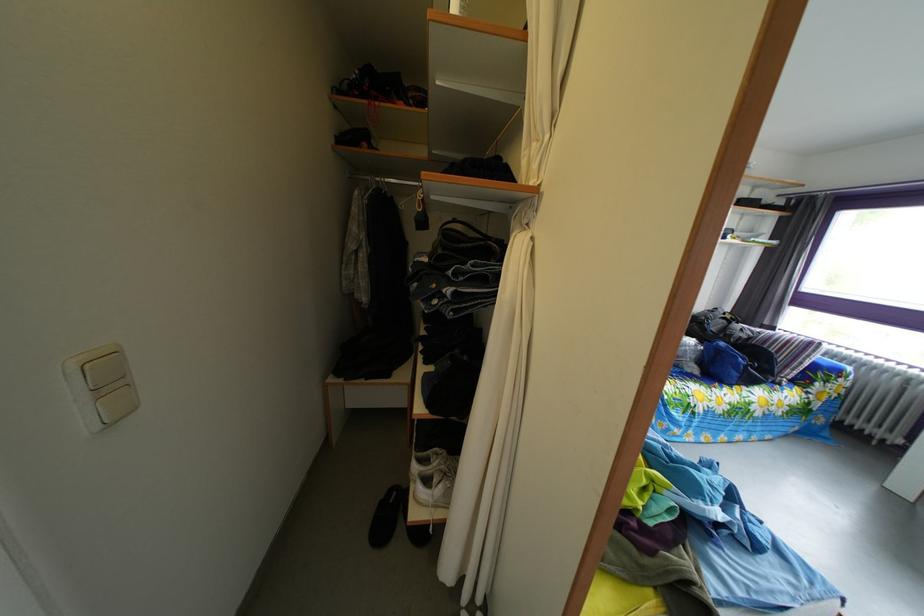
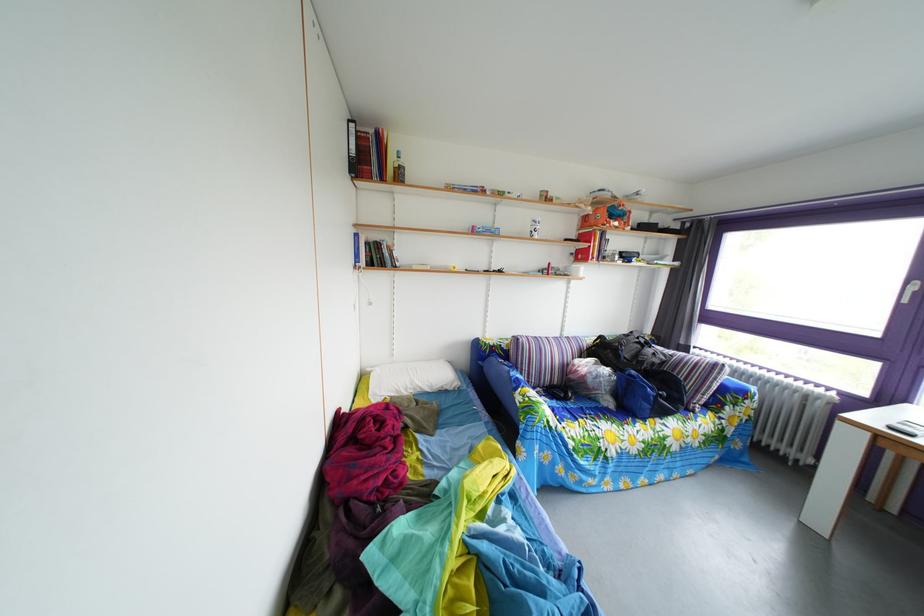
Question: Based on the continuous images, in which direction is the camera rotating? Reply with the corresponding letter.

Choices:
 (A) Left
 (B) Right
 (C) Up
 (D) Down

Answer: (B)